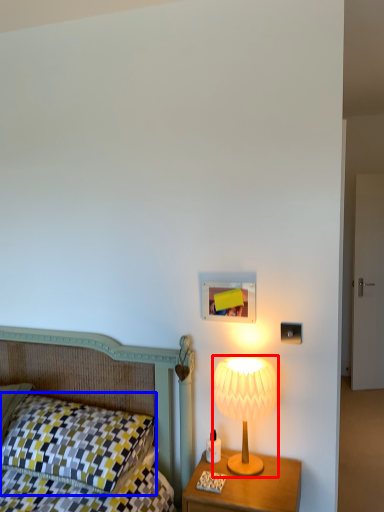
Question: Which of the following is the farthest to the observer, lamp (highlighted by a red box) or pillow (highlighted by a blue box)?

Choices:
 (A) lamp
 (B) pillow

Answer: (A)